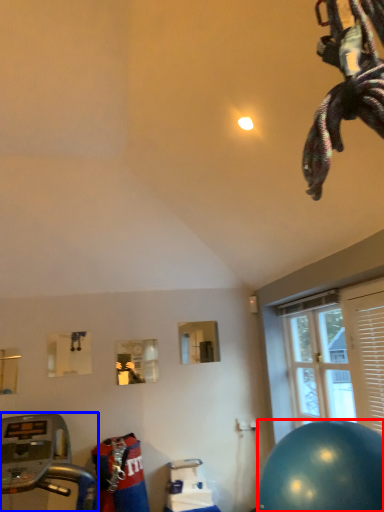
Question: Which point is further to the camera, ball (highlighted by a red box) or treadmill (highlighted by a blue box)?

Choices:
 (A) ball
 (B) treadmill

Answer: (A)